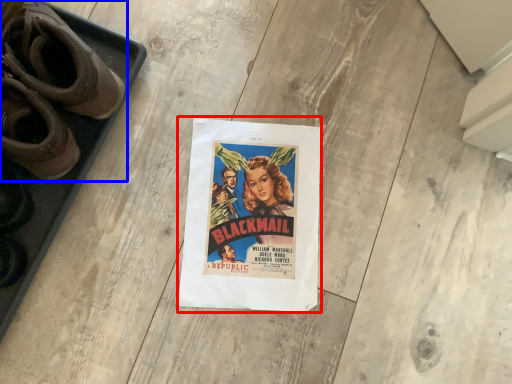
Question: Which point is closer to the camera, poster (highlighted by a red box) or footwear (highlighted by a blue box)?

Choices:
 (A) poster
 (B) footwear

Answer: (B)